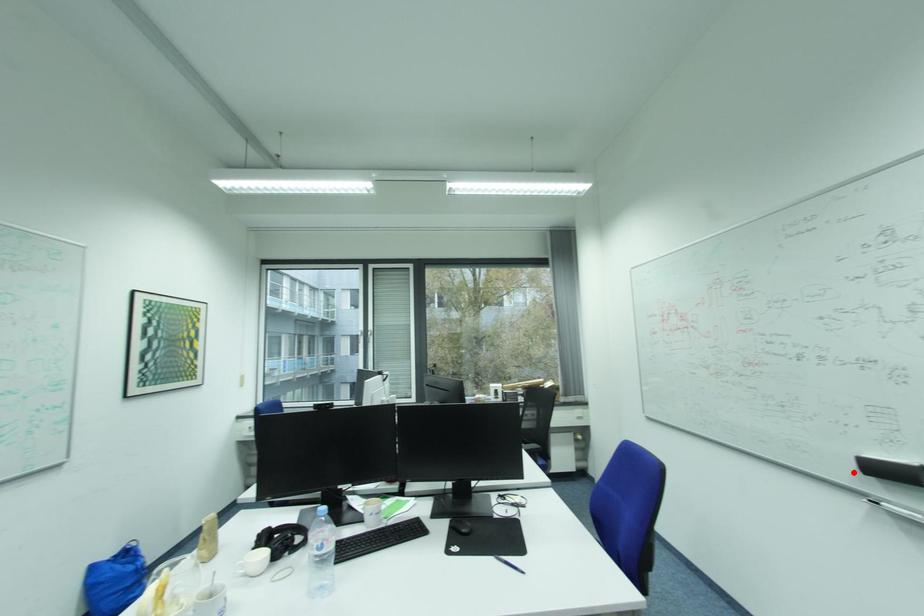
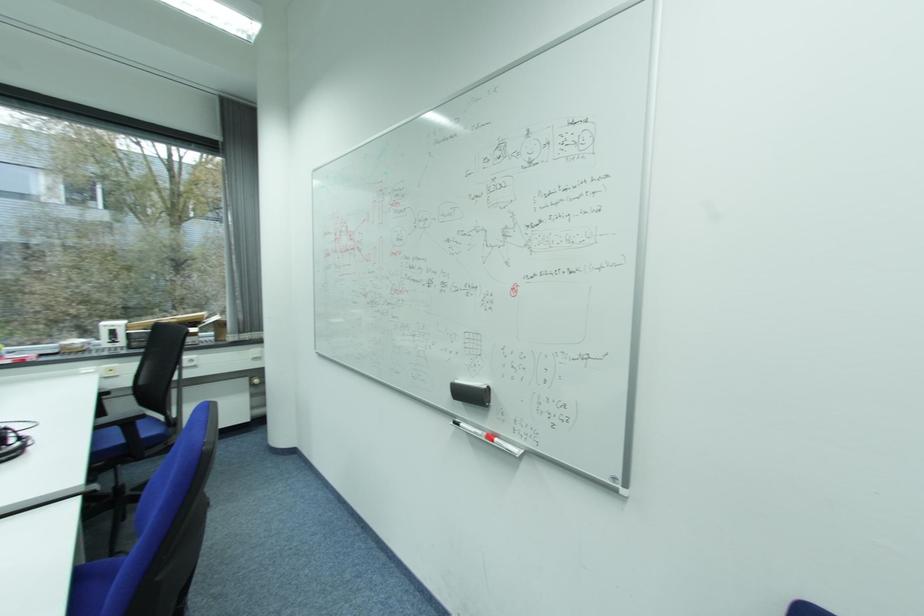
Find the pixel in the second image that matches the highlighted location in the first image.

(453, 398)